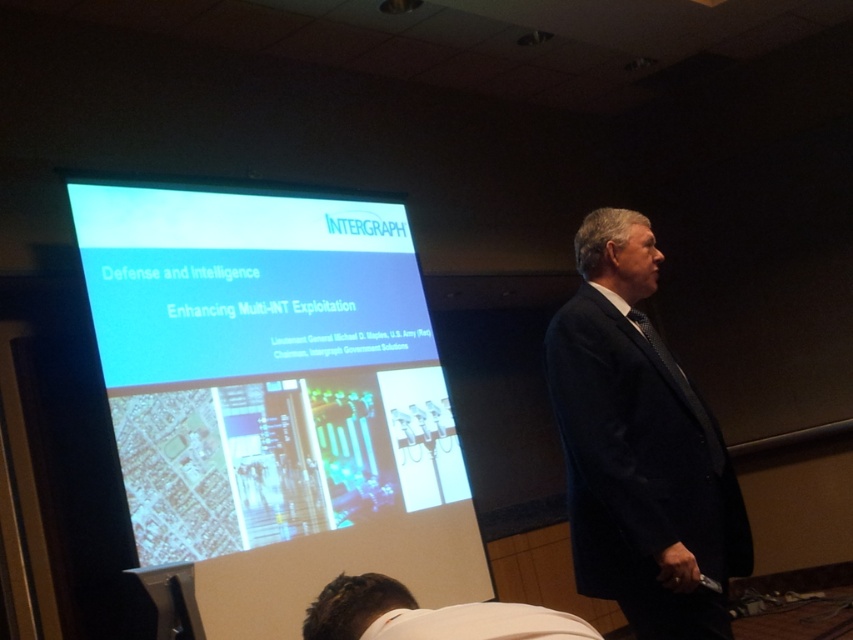
From the picture: You are an attendee at the presentation and want to take a photo of the white glossy projector screen at upper center. The screen is located at coordinates point 0.627, 0.321. If your camera has a zoom lens that can focus on objects within a radius of 0.5 units from your current position at point 0.5, 0.5, will you be able to capture the screen clearly?

The white glossy projector screen at upper center is located at point [273,401]. Your current position is at point [426,320]. The distance between these points is sqrt. Since the zoom lens can focus within a radius of 0.5 units, you will be able to capture the screen clearly.

You are an attendee at the presentation. You want to take a photo of the white glossy projector screen at upper center but need to avoid blocking the white fabric shirt at lower center. Is the screen positioned in a way that allows you to do so without obstructing the shirt?

The white glossy projector screen at upper center is further to the viewer than the white fabric shirt at lower center. This means you can position yourself to take a photo of the screen without blocking the shirt, as the screen is closer to you and the shirt is behind it.